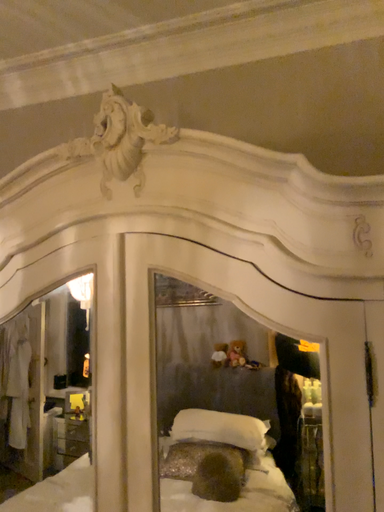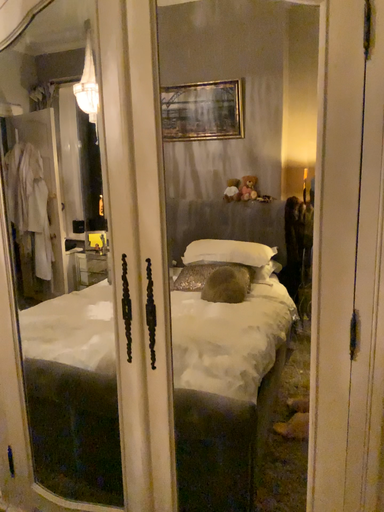
Question: How did the camera likely rotate when shooting the video?

Choices:
 (A) rotated downward
 (B) rotated upward

Answer: (A)